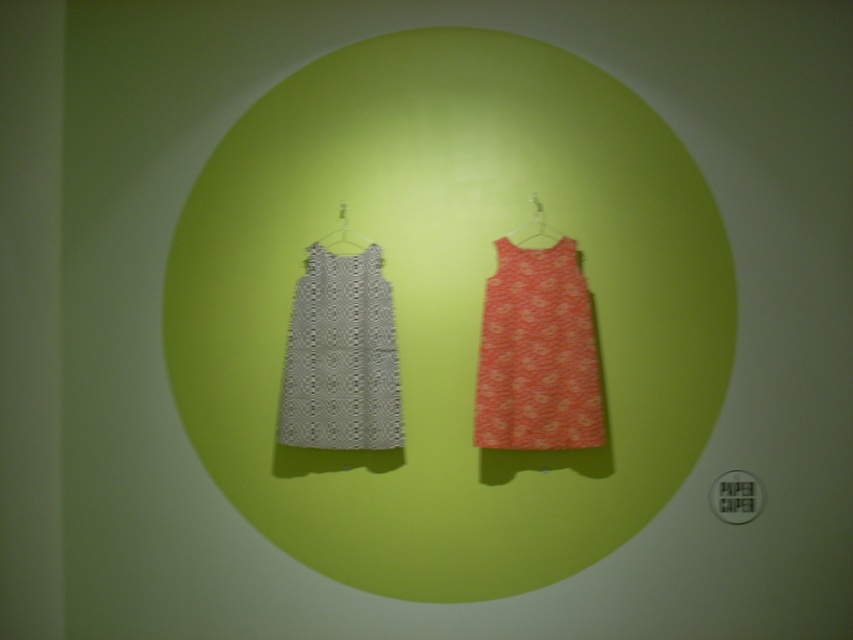
Is matte orange dress at center positioned in front of white plastic hanger at center?

Yes.

Looking at this image, does matte orange dress at center appear over white plastic hanger at center?

No, matte orange dress at center is not above white plastic hanger at center.

Describe the element at coordinates (537, 353) in the screenshot. I see `matte orange dress at center` at that location.

Where is `matte orange dress at center`? This screenshot has width=853, height=640. matte orange dress at center is located at coordinates (x=537, y=353).

The width and height of the screenshot is (853, 640). I want to click on gray textured dress at center, so click(341, 356).

Is the position of gray textured dress at center more distant than that of white plastic hanger at center?

That is False.

I want to click on gray textured dress at center, so click(341, 356).

Does white plastic hanger at center come in front of metallic silver hanger at upper center?

No, it is not.

In the scene shown: Measure the distance from white plastic hanger at center to metallic silver hanger at upper center.

15.78 inches

The image size is (853, 640). I want to click on white plastic hanger at center, so click(x=341, y=236).